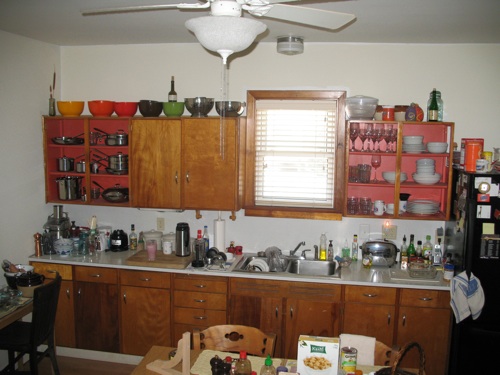
I want to click on sink, so click(x=276, y=264), click(x=257, y=257).